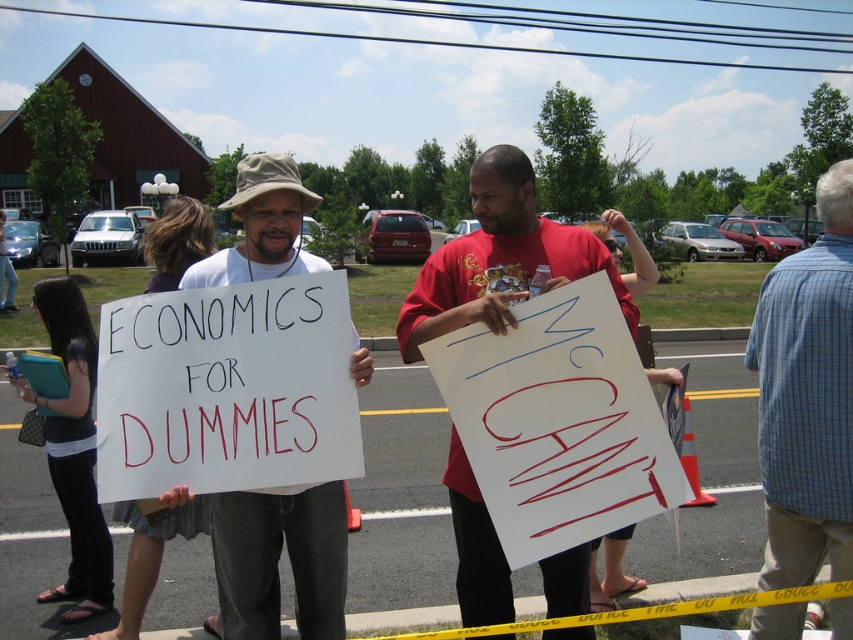
Question: Which object is positioned closest to the blue plaid shirt at upper right?

Choices:
 (A) white paper sign at center
 (B) red cotton shirt at center

Answer: (B)

Question: Can you confirm if blue plaid shirt at upper right is bigger than red cotton shirt at center?

Choices:
 (A) yes
 (B) no

Answer: (B)

Question: Is red cotton shirt at center wider than white paper sign at center?

Choices:
 (A) yes
 (B) no

Answer: (A)

Question: Which point is closer to the camera taking this photo?

Choices:
 (A) click(480, 182)
 (B) click(816, 520)

Answer: (A)

Question: Which of the following is the closest to the observer?

Choices:
 (A) white paper sign at center
 (B) red cotton shirt at center
 (C) blue plaid shirt at upper right

Answer: (B)

Question: Does red cotton shirt at center appear on the left side of white paper sign at center?

Choices:
 (A) yes
 (B) no

Answer: (B)